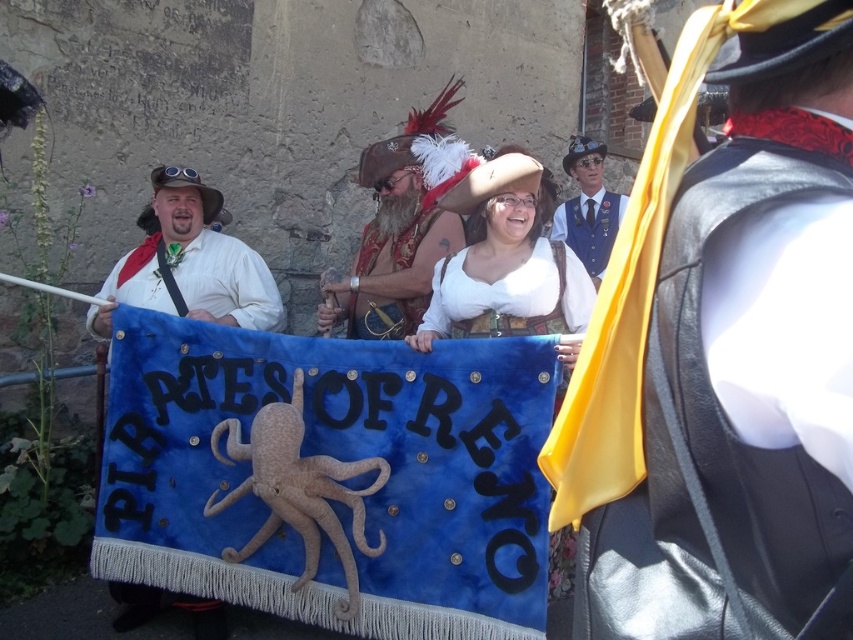
Question: Estimate the real-world distances between objects in this image. Which object is farther from the blue velvet vest at upper center?

Choices:
 (A) leather vest at center
 (B) matte white shirt at center

Answer: (A)

Question: Where is matte white shirt at center located in relation to bearded man with feathered hat at center in the image?

Choices:
 (A) above
 (B) below

Answer: (B)

Question: Which object is the closest to the blue velvet vest at upper center?

Choices:
 (A) matte white shirt at center
 (B) white satin blouse at center
 (C) velvet pirate hat at center

Answer: (C)

Question: Can you confirm if blue velvet vest at upper center is thinner than velvet pirate hat at center?

Choices:
 (A) yes
 (B) no

Answer: (B)

Question: Among these objects, which one is farthest from the camera?

Choices:
 (A) blue velvet vest at upper center
 (B) matte white shirt at center
 (C) leather vest at center
 (D) bearded man with feathered hat at center

Answer: (A)

Question: Does white satin blouse at center have a larger size compared to blue velvet vest at upper center?

Choices:
 (A) no
 (B) yes

Answer: (A)